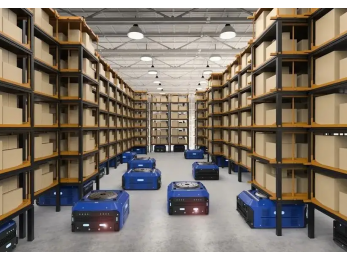
You are a GUI agent. You are given a task and a screenshot of the screen. Output one action in this format:
    pyautogui.click(x=<x>, y=<y>)
    Task: Click on the red glowing light
    This screenshot has width=347, height=260.
    Given the screenshot: What is the action you would take?
    102,226, 196,209